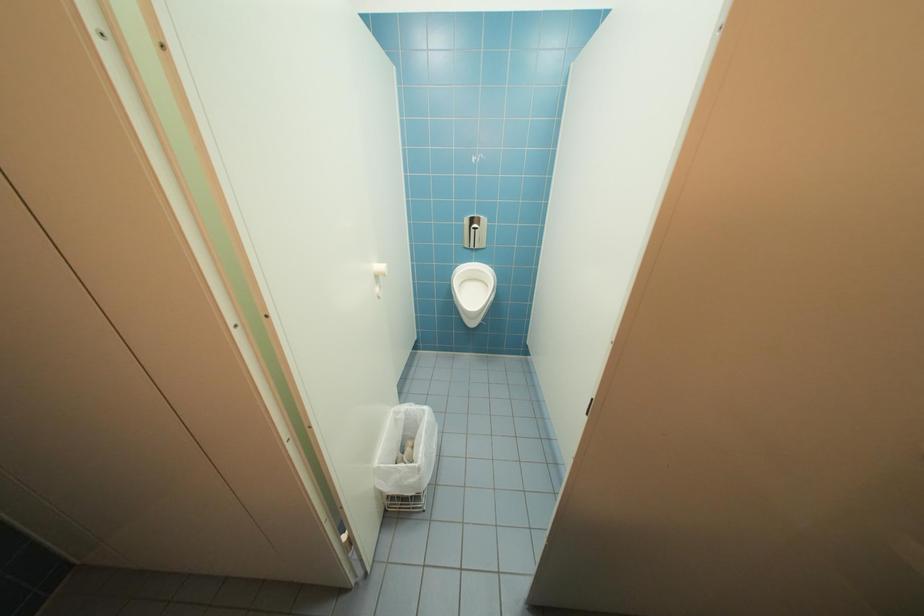
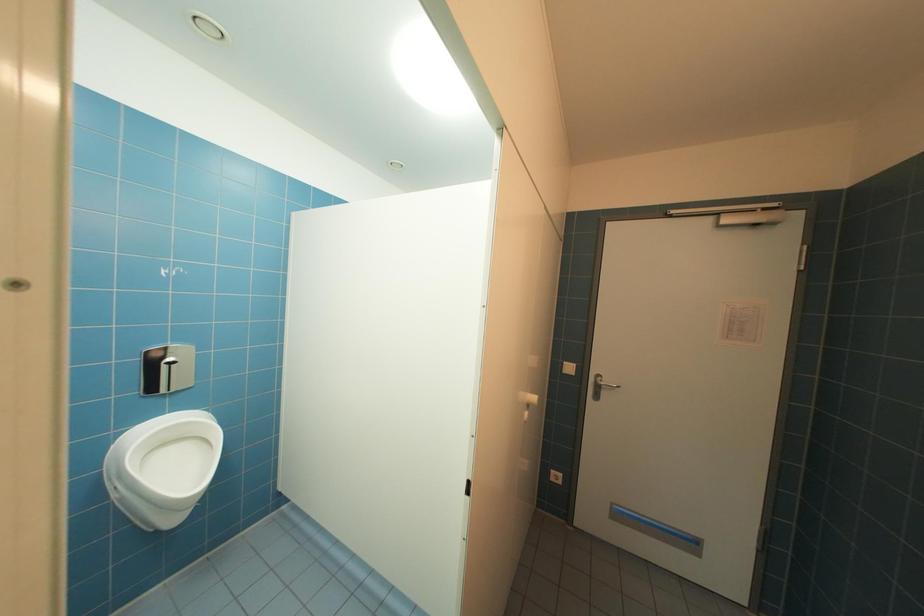
Question: The camera is either moving clockwise (left) or counter-clockwise (right) around the object. The first image is from the beginning of the video and the second image is from the end. Is the camera moving left or right when shooting the video?

Choices:
 (A) Left
 (B) Right

Answer: (A)